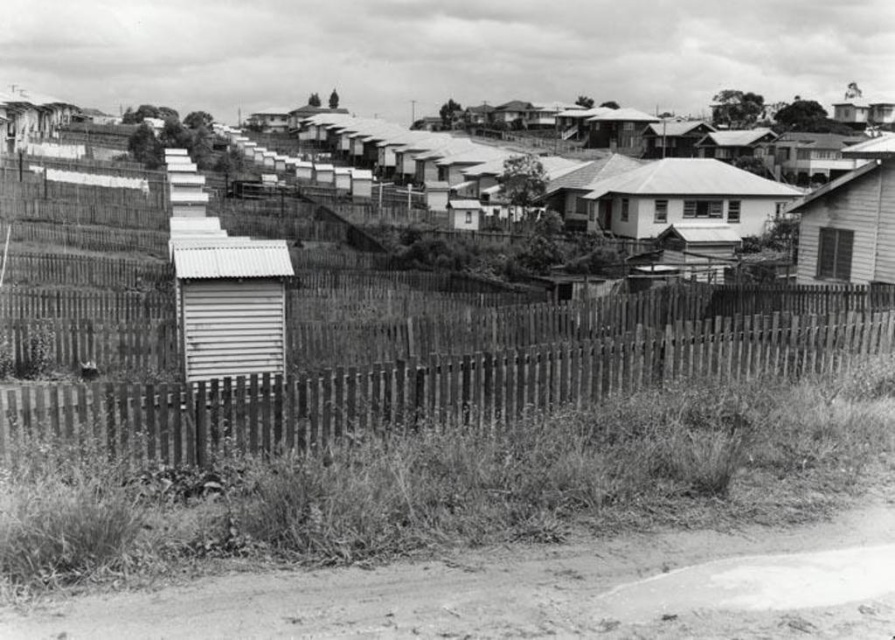
You are standing on the dirt road in the residential area and want to go to the wooden shack at right. Which direction should you turn to walk towards it from the white corrugated metal hut at center?

You should turn to the right to walk towards the wooden shack at right from the white corrugated metal hut at center since the wooden shack at right is to the right of the white corrugated metal hut at center.

You are a delivery person trying to park your van between the white corrugated metal hut at center and the wooden shack at right. Given that your van is 4 meters long, can you fit it in the available space between them?

The white corrugated metal hut at center occupies less space than wooden shack at right, but the exact distance between them isn not specified. Without knowing the actual space between the two structures, it is impossible to determine if the van will fit.